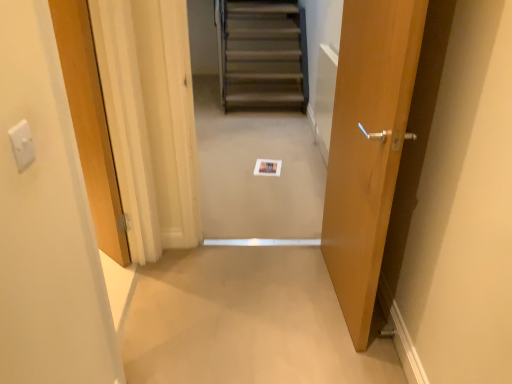
Question: Is matte wood door at right, the 1th door in the right-to-left sequence, situated inside wooden door at center, marked as the 2th door in a right-to-left arrangement, or outside?

Choices:
 (A) inside
 (B) outside

Answer: (B)

Question: From a real-world perspective, is matte wood door at right, which is the 2th door in left-to-right order, positioned above or below wooden door at center, marked as the 2th door in a right-to-left arrangement?

Choices:
 (A) above
 (B) below

Answer: (A)

Question: Considering the real-world distances, which object is farthest from the white plastic electric outlet at upper left?

Choices:
 (A) wooden stairs at center
 (B) wooden door at center, which ranks as the first door in left-to-right order
 (C) beige carpet at center
 (D) matte wood door at right, which is the 2th door in left-to-right order

Answer: (A)

Question: Which object is positioned closest to the wooden stairs at center?

Choices:
 (A) white plastic electric outlet at upper left
 (B) matte wood door at right, which is the 2th door in left-to-right order
 (C) beige carpet at center
 (D) wooden door at center, marked as the 2th door in a right-to-left arrangement

Answer: (C)